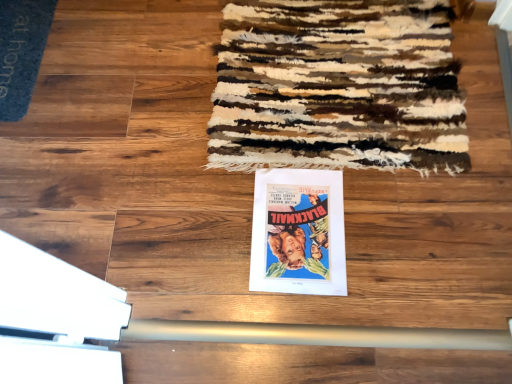
The width and height of the screenshot is (512, 384). In order to click on vacant space that's between blue carpet at upper left and matte paper poster at center in this screenshot , I will do `click(146, 133)`.